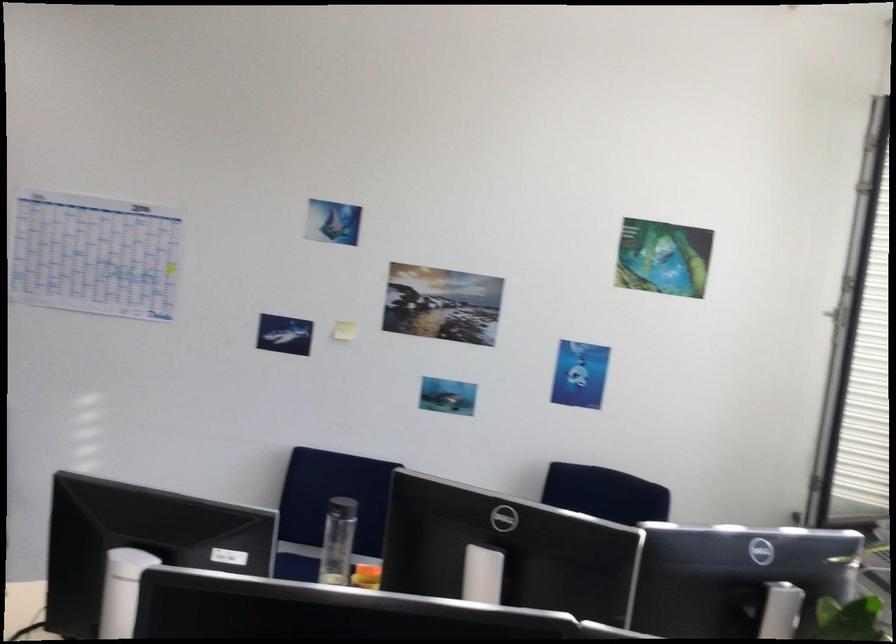
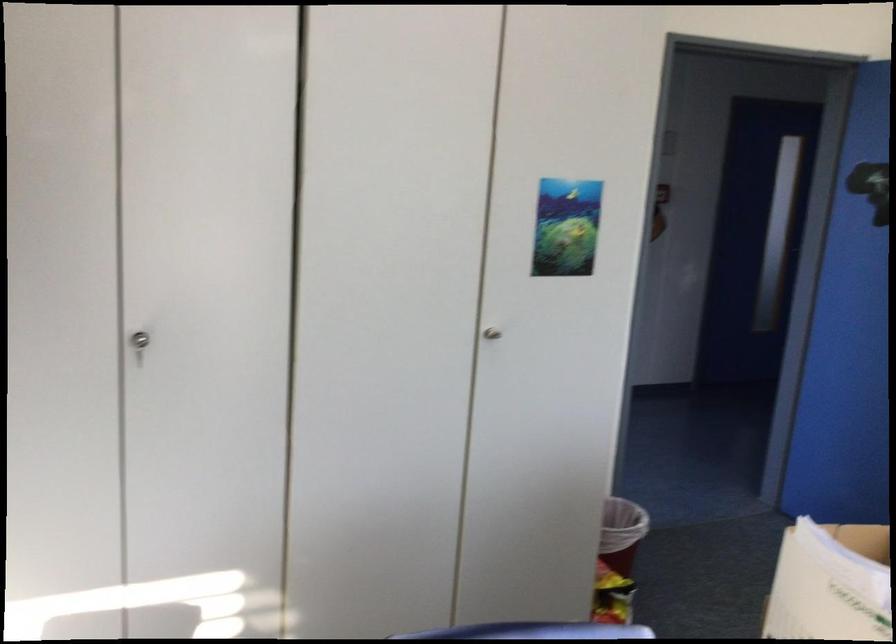
Question: Based on the continuous images, in which direction is the camera rotating? Reply with the corresponding letter.

Choices:
 (A) Left
 (B) Right
 (C) Up
 (D) Down

Answer: (A)